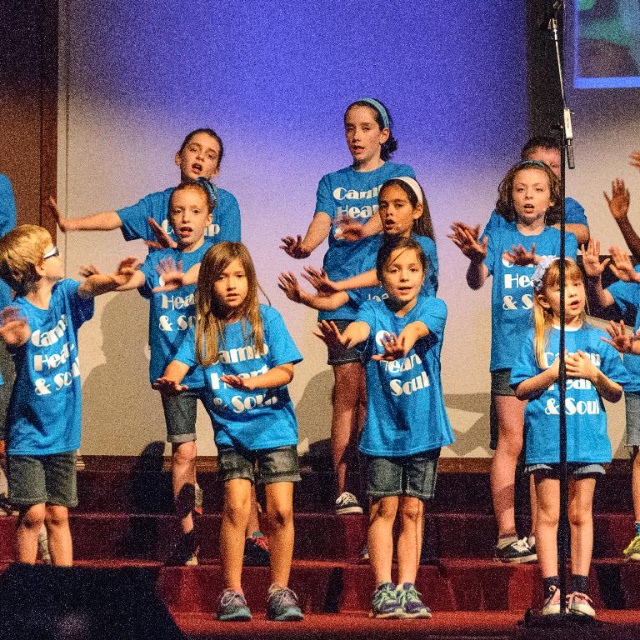
Question: Which object appears closest to the camera in this image?

Choices:
 (A) matte blue t-shirt at left
 (B) matte blue shirt at center

Answer: (B)

Question: Considering the relative positions of matte blue t-shirt at center and matte blue t-shirt at left in the image provided, where is matte blue t-shirt at center located with respect to matte blue t-shirt at left?

Choices:
 (A) above
 (B) below

Answer: (B)

Question: Considering the real-world distances, which object is closest to the matte blue t-shirt at left?

Choices:
 (A) matte blue shirt at center
 (B) matte blue t-shirt at center

Answer: (B)

Question: Is the position of matte blue shirt at center more distant than that of matte blue t-shirt at left?

Choices:
 (A) no
 (B) yes

Answer: (A)

Question: Observing the image, what is the correct spatial positioning of matte blue t-shirt at center in reference to matte blue t-shirt at left?

Choices:
 (A) above
 (B) below

Answer: (B)

Question: Which is nearer to the matte blue t-shirt at center?

Choices:
 (A) matte blue shirt at center
 (B) matte blue t-shirt at left

Answer: (B)